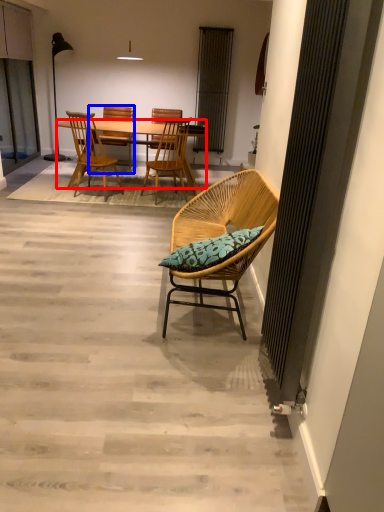
Question: Which of the following is the closest to the observer, desk (highlighted by a red box) or chair (highlighted by a blue box)?

Choices:
 (A) desk
 (B) chair

Answer: (A)